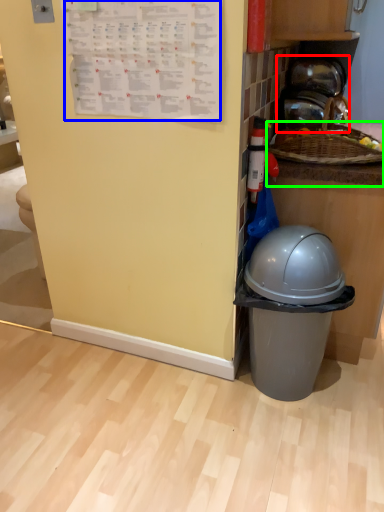
Question: Estimate the real-world distances between objects in this image. Which object is closer to appliance (highlighted by a red box), writing (highlighted by a blue box) or counter top (highlighted by a green box)?

Choices:
 (A) writing
 (B) counter top

Answer: (B)